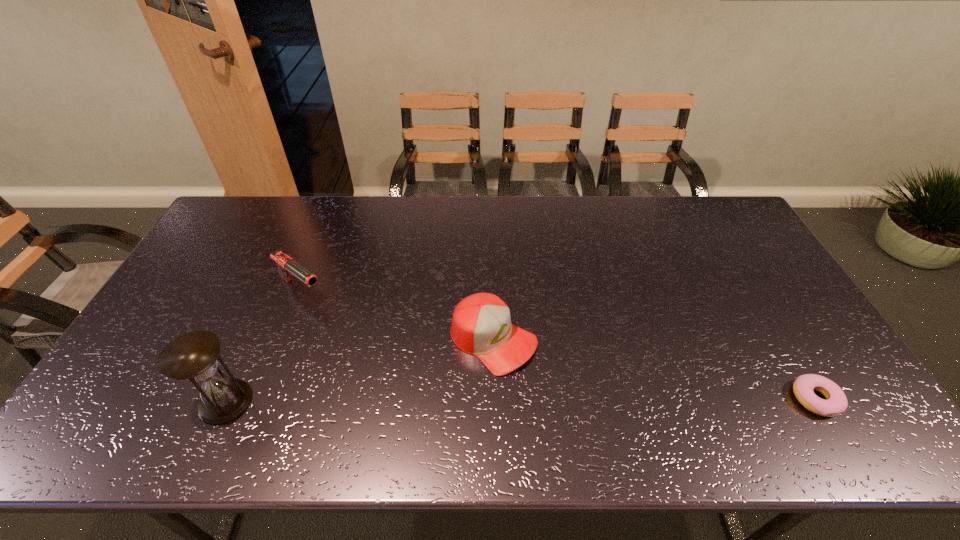
Locate an element on the screen. vacant area situated on the front-facing side of the baseball cap is located at coordinates (580, 401).

Identify the location of vacant space located on the front-facing side of the baseball cap. (557, 384).

Locate an element on the screen. This screenshot has width=960, height=540. hourglass located in the near edge section of the desktop is located at coordinates (193, 356).

Locate an element on the screen. The width and height of the screenshot is (960, 540). doughnut present at the near edge is located at coordinates (836, 403).

You are a GUI agent. You are given a task and a screenshot of the screen. Output one action in this format:
    pyautogui.click(x=<x>, y=<y>)
    Task: Click on the baseball cap positioned at the near edge
    
    Given the screenshot: What is the action you would take?
    pyautogui.click(x=481, y=324)

Identify the location of object at the right edge. The height and width of the screenshot is (540, 960). (836, 403).

What are the coordinates of `object that is at the near right corner` in the screenshot? It's located at (836, 403).

The image size is (960, 540). I want to click on vacant area at the far edge, so click(544, 226).

Where is `free location at the near edge`? free location at the near edge is located at coordinates (423, 383).

Where is `free space at the left edge of the desktop`? Image resolution: width=960 pixels, height=540 pixels. free space at the left edge of the desktop is located at coordinates (152, 347).